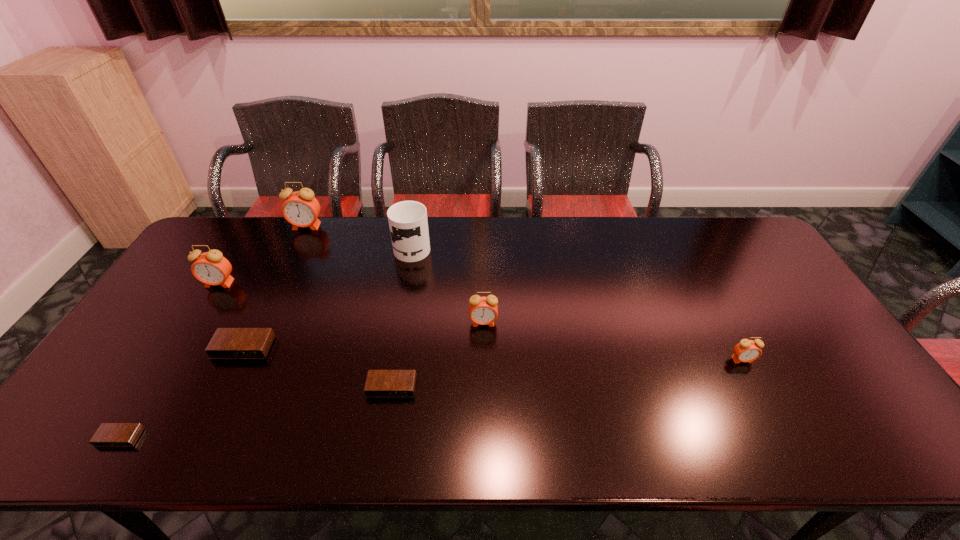
Where is `the farthest black alarm clock`? This screenshot has height=540, width=960. the farthest black alarm clock is located at coordinates (227, 343).

Find the location of a particular element. the second black alarm clock from left to right is located at coordinates (227, 343).

Locate an element on the screen. This screenshot has height=540, width=960. the second shortest alarm clock is located at coordinates (379, 383).

This screenshot has width=960, height=540. What are the coordinates of `the fifth alarm clock from left to right` in the screenshot? It's located at (379, 383).

Find the location of a particular element. The height and width of the screenshot is (540, 960). the nearest alarm clock is located at coordinates (108, 434).

At what (x,y) coordinates should I click in order to perform the action: click on the nearest object. Please return your answer as a coordinate pair (x, y). Looking at the image, I should click on [108, 434].

Image resolution: width=960 pixels, height=540 pixels. Find the location of `free location located on the face of the farthest object`. free location located on the face of the farthest object is located at coordinates (290, 260).

Image resolution: width=960 pixels, height=540 pixels. Identify the location of free region located on the handle side of the mug. (418, 218).

Identify the location of free region located 0.210m on the face of the sixth shortest alarm clock. (182, 343).

This screenshot has height=540, width=960. Find the location of `free region located on the face of the fifth shortest object`. free region located on the face of the fifth shortest object is located at coordinates (484, 347).